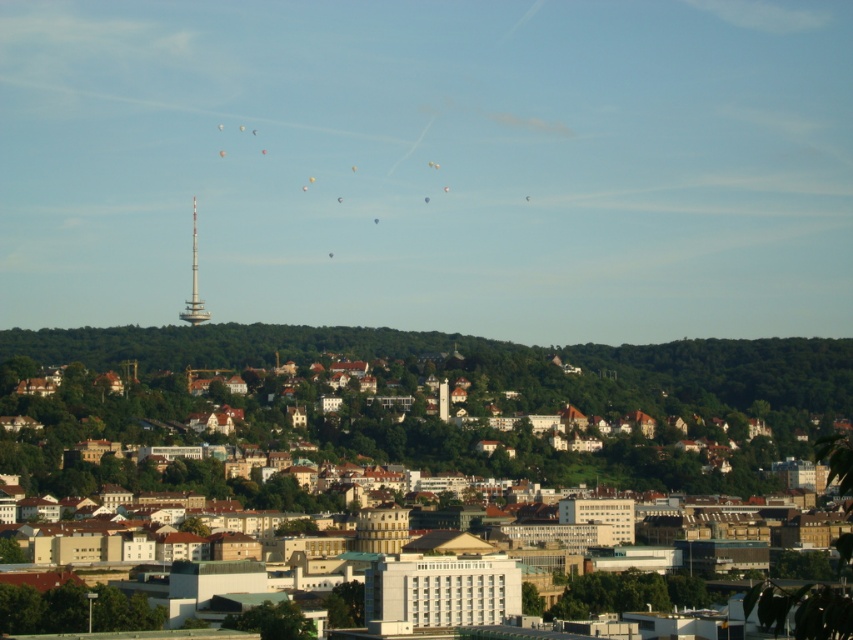
You are an urban planner reviewing the city layout. You need to decide where to place a new public park. The park must be closer to the white matte building at center than to the silver metallic tower at center. Based on the image, is there enough space between them to accommodate the park?

The white matte building at center is closer to the viewer than the silver metallic tower at center, so there is sufficient space between them to place the park closer to the white matte building at center.

You are an urban planner analyzing the city layout. Based on the scene, which of the two structures, the white matte building at center or the silver metallic tower at center, would require more space for construction due to its size?

The white matte building at center is larger in size than the silver metallic tower at center, so it would require more space for construction.

You are a city planner reviewing the urban layout. Based on the image, where is the white matte building at center located in relation to the large hill?

The white matte building at center is located at point (437, 417), which places it in the mid to lower section of the image, likely positioned between the urban area and the large hill.